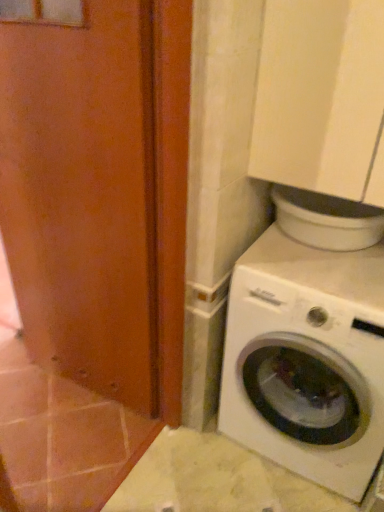
Describe the element at coordinates (82, 189) in the screenshot. This screenshot has width=384, height=512. I see `matte orange screen door at left` at that location.

Where is `matte orange screen door at left`? matte orange screen door at left is located at coordinates (82, 189).

This screenshot has height=512, width=384. Describe the element at coordinates (307, 360) in the screenshot. I see `white matte washing machine at lower right` at that location.

At what (x,y) coordinates should I click in order to perform the action: click on white matte washing machine at lower right. Please return your answer as a coordinate pair (x, y). Image resolution: width=384 pixels, height=512 pixels. Looking at the image, I should click on (307, 360).

Find the location of a particular element. The image size is (384, 512). matte orange screen door at left is located at coordinates (82, 189).

Considering the relative positions of matte orange screen door at left and white matte washing machine at lower right in the image provided, is matte orange screen door at left to the left of white matte washing machine at lower right from the viewer's perspective?

Correct, you'll find matte orange screen door at left to the left of white matte washing machine at lower right.

Consider the image. Is matte orange screen door at left further to camera compared to white matte washing machine at lower right?

No, matte orange screen door at left is closer to the camera.

Is point (70, 179) positioned behind point (265, 326)?

Yes, point (70, 179) is behind point (265, 326).

From the image's perspective, does matte orange screen door at left appear higher than white matte washing machine at lower right?

Yes.

From a real-world perspective, does matte orange screen door at left stand above white matte washing machine at lower right?

Correct, in the physical world, matte orange screen door at left is higher than white matte washing machine at lower right.

Does matte orange screen door at left have a lesser width compared to white matte washing machine at lower right?

Correct, the width of matte orange screen door at left is less than that of white matte washing machine at lower right.

Considering the sizes of objects matte orange screen door at left and white matte washing machine at lower right in the image provided, who is shorter, matte orange screen door at left or white matte washing machine at lower right?

white matte washing machine at lower right.

Can you confirm if matte orange screen door at left is smaller than white matte washing machine at lower right?

Yes, matte orange screen door at left is smaller than white matte washing machine at lower right.

Would you say matte orange screen door at left is inside or outside white matte washing machine at lower right?

matte orange screen door at left is not enclosed by white matte washing machine at lower right.

Is there a large distance between matte orange screen door at left and white matte washing machine at lower right?

That's not correct — matte orange screen door at left is a little close to white matte washing machine at lower right.

Is matte orange screen door at left positioned with its back to white matte washing machine at lower right?

No, matte orange screen door at left is not facing the opposite direction of white matte washing machine at lower right.

How far apart are matte orange screen door at left and white matte washing machine at lower right?

They are 24.40 inches apart.

Find the location of a particular element. The image size is (384, 512). washing machine beneath the matte orange screen door at left (from a real-world perspective) is located at coordinates (307, 360).

In the image, is white matte washing machine at lower right on the left side or the right side of matte orange screen door at left?

white matte washing machine at lower right is to the right of matte orange screen door at left.

Is white matte washing machine at lower right positioned in front of matte orange screen door at left?

No, it is behind matte orange screen door at left.

Is point (283, 383) closer or farther from the camera than point (15, 165)?

Clearly, point (283, 383) is more distant from the camera than point (15, 165).

From the image's perspective, is white matte washing machine at lower right above or below matte orange screen door at left?

white matte washing machine at lower right is situated lower than matte orange screen door at left in the image.

From a real-world perspective, which is physically below, white matte washing machine at lower right or matte orange screen door at left?

From a 3D spatial view, white matte washing machine at lower right is below.

Considering the relative sizes of white matte washing machine at lower right and matte orange screen door at left in the image provided, is white matte washing machine at lower right thinner than matte orange screen door at left?

No.

Is white matte washing machine at lower right taller than matte orange screen door at left?

No, white matte washing machine at lower right is not taller than matte orange screen door at left.

Consider the image. Looking at the image, does white matte washing machine at lower right seem bigger or smaller compared to matte orange screen door at left?

Considering their sizes, white matte washing machine at lower right takes up more space than matte orange screen door at left.

Based on the photo, is white matte washing machine at lower right spatially inside matte orange screen door at left, or outside of it?

white matte washing machine at lower right is outside matte orange screen door at left.

Is there a large distance between white matte washing machine at lower right and matte orange screen door at left?

white matte washing machine at lower right is actually quite close to matte orange screen door at left.

Is white matte washing machine at lower right looking in the opposite direction of matte orange screen door at left?

No.

What's the angular difference between white matte washing machine at lower right and matte orange screen door at left's facing directions?

There is a 4.7-degree angle between the facing directions of white matte washing machine at lower right and matte orange screen door at left.

The width and height of the screenshot is (384, 512). I want to click on screen door that is above the white matte washing machine at lower right (from the image's perspective), so click(x=82, y=189).

You are a GUI agent. You are given a task and a screenshot of the screen. Output one action in this format:
    pyautogui.click(x=<x>, y=<y>)
    Task: Click on the washing machine lying on the right of matte orange screen door at left
    
    Given the screenshot: What is the action you would take?
    pyautogui.click(x=307, y=360)

Where is `washing machine that is behind the matte orange screen door at left`? The height and width of the screenshot is (512, 384). washing machine that is behind the matte orange screen door at left is located at coordinates (307, 360).